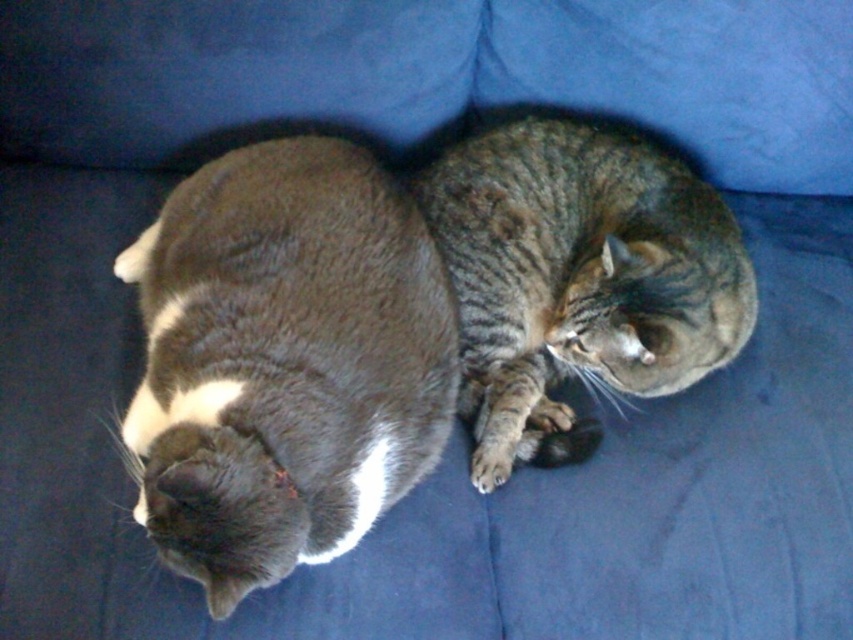
Between point (360, 260) and point (643, 269), which one is positioned in front?

Point (360, 260) is in front.

The height and width of the screenshot is (640, 853). In order to click on gray fur cat at center in this screenshot , I will do `click(283, 362)`.